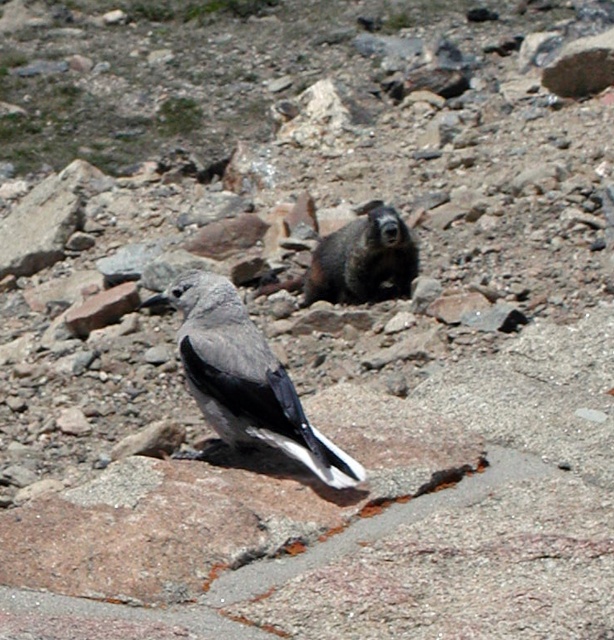
You are standing at the origin point in the image. There are two points marked in the scene. Which point is closer to you, point (254, 348) or point (368, 230)?

Point (254, 348) is in front of point (368, 230), so it is closer to you.

You are a hiker who wants to take a photo of the gray matte bird at center and the brown furry rock at center. Since you have a camera with a fixed focal length, you need to know which object is closer to adjust your focus. Based on the scene, which one is closer to you?

The gray matte bird at center is closer to you because it is positioned in the foreground of the scene, while the brown furry rock at center is further away in the background.